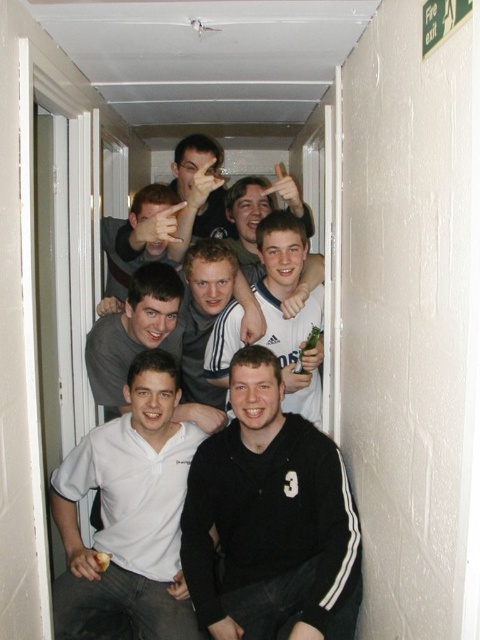
Question: Can you confirm if black fleece at center is positioned below white matte shirt at center?

Choices:
 (A) no
 (B) yes

Answer: (B)

Question: Is white matte polo shirt at lower left positioned in front of white matte shirt at center?

Choices:
 (A) yes
 (B) no

Answer: (A)

Question: Among these points, which one is nearest to the camera?

Choices:
 (A) (320, 637)
 (B) (267, 346)

Answer: (A)

Question: Which object appears closest to the camera in this image?

Choices:
 (A) black fleece at center
 (B) white matte polo shirt at lower left

Answer: (A)

Question: Which object is farther from the camera taking this photo?

Choices:
 (A) black fleece at center
 (B) white matte polo shirt at lower left
 (C) white matte shirt at center

Answer: (C)

Question: Considering the relative positions of black fleece at center and white matte polo shirt at lower left in the image provided, where is black fleece at center located with respect to white matte polo shirt at lower left?

Choices:
 (A) left
 (B) right

Answer: (B)